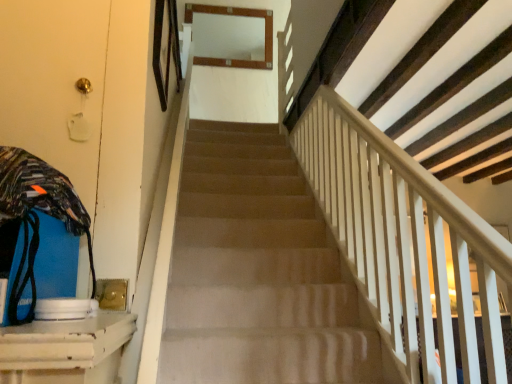
Describe the element at coordinates (54, 83) in the screenshot. I see `matte plastic door at left` at that location.

Image resolution: width=512 pixels, height=384 pixels. Identify the location of matte plastic door at left. (54, 83).

Where is `matte plastic door at left`? This screenshot has height=384, width=512. matte plastic door at left is located at coordinates (54, 83).